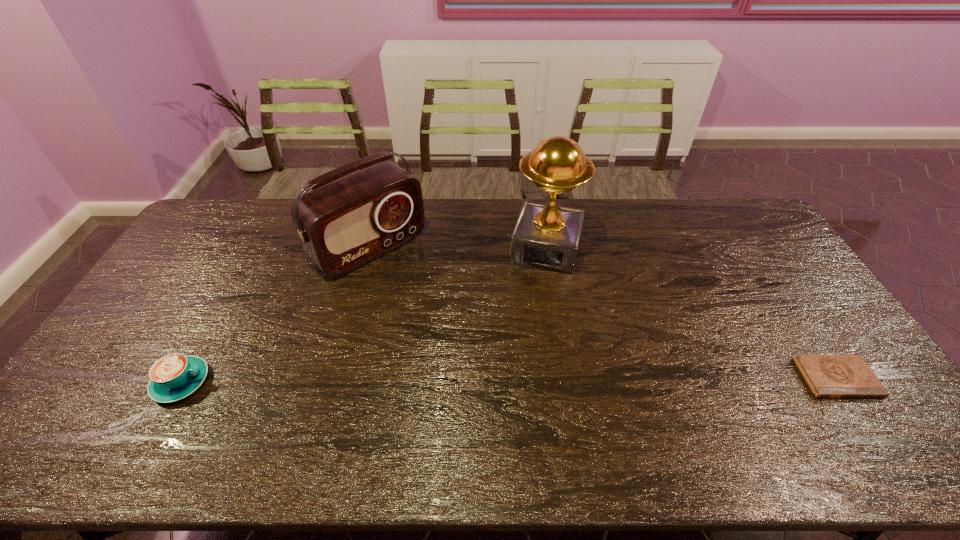
Locate an element on the screen. object located in the near right corner section of the desktop is located at coordinates (828, 376).

In the image, there is a desktop. In order to click on free space at the near edge in this screenshot , I will do `click(433, 418)`.

Find the location of `vacant space at the left edge of the desktop`. vacant space at the left edge of the desktop is located at coordinates (120, 334).

Find the location of a particular element. This screenshot has width=960, height=540. vacant position at the right edge of the desktop is located at coordinates (753, 243).

The image size is (960, 540). Identify the location of free space at the far right corner of the desktop. (723, 206).

This screenshot has width=960, height=540. Identify the location of blank region between the shortest object and the award. (691, 313).

Where is `vacant space in between the second object from left to right and the shortest object`? This screenshot has width=960, height=540. vacant space in between the second object from left to right and the shortest object is located at coordinates tap(603, 313).

Where is `free spot between the leftmost object and the award`? Image resolution: width=960 pixels, height=540 pixels. free spot between the leftmost object and the award is located at coordinates (364, 315).

Identify the location of free space between the leftmost object and the third shortest object. (276, 315).

This screenshot has width=960, height=540. In order to click on vacant space in between the diary and the tallest object in this screenshot , I will do `click(691, 313)`.